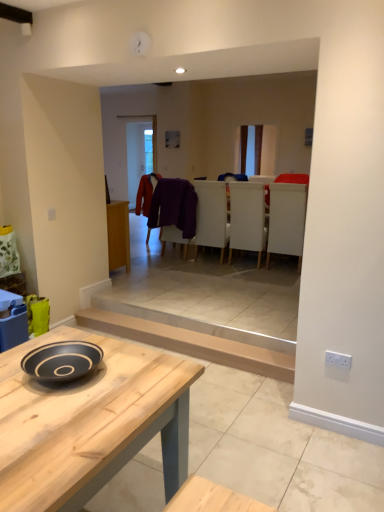
At what (x,y) coordinates should I click in order to perform the action: click on vacant area on top of light brown wooden plank at lower center (from a real-world perspective). Please return your answer as a coordinate pair (x, y). The width and height of the screenshot is (384, 512). Looking at the image, I should click on (176, 324).